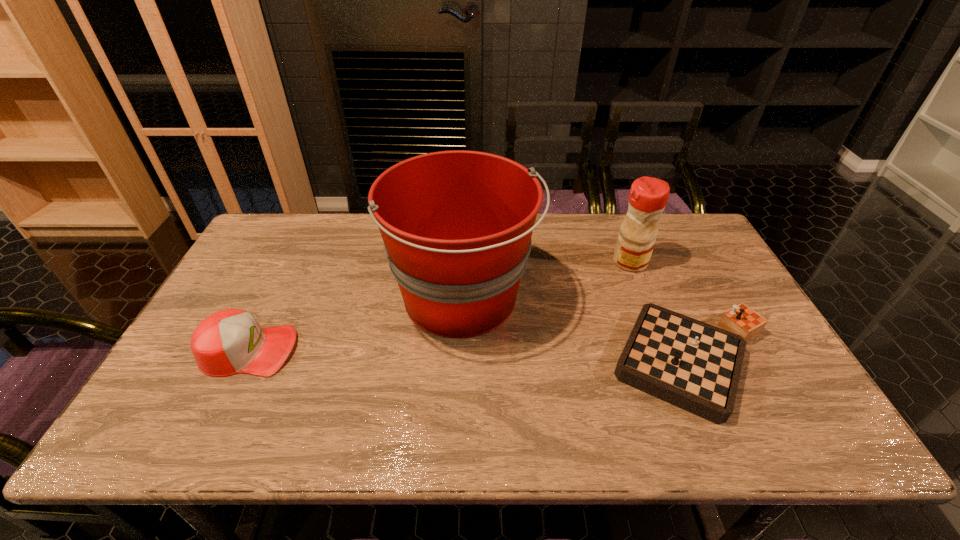
The image size is (960, 540). In order to click on bucket that is at the far edge in this screenshot , I will do [457, 225].

Find the location of a particular element. condiment that is at the far edge is located at coordinates (648, 196).

Locate an element on the screen. This screenshot has height=540, width=960. object that is at the near edge is located at coordinates (693, 365).

What are the coordinates of `object that is positioned at the left edge` in the screenshot? It's located at (231, 341).

The width and height of the screenshot is (960, 540). Find the location of `object located in the right edge section of the desktop`. object located in the right edge section of the desktop is located at coordinates (693, 365).

The image size is (960, 540). In order to click on object located in the near right corner section of the desktop in this screenshot , I will do `click(693, 365)`.

Where is `free region at the far edge`? The height and width of the screenshot is (540, 960). free region at the far edge is located at coordinates (353, 226).

The width and height of the screenshot is (960, 540). I want to click on blank space at the near edge of the desktop, so click(556, 434).

The width and height of the screenshot is (960, 540). I want to click on blank space at the left edge of the desktop, so click(207, 409).

What are the coordinates of `vacant space at the right edge of the desktop` in the screenshot? It's located at (742, 298).